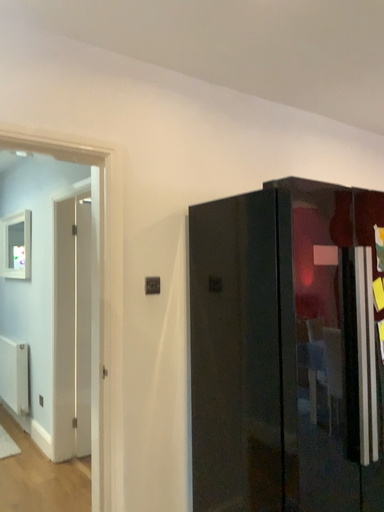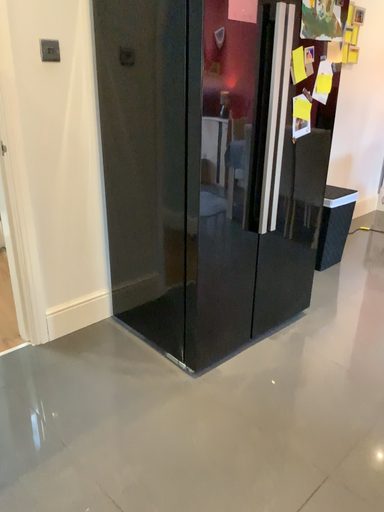
Question: How did the camera likely rotate when shooting the video?

Choices:
 (A) rotated left
 (B) rotated right

Answer: (B)